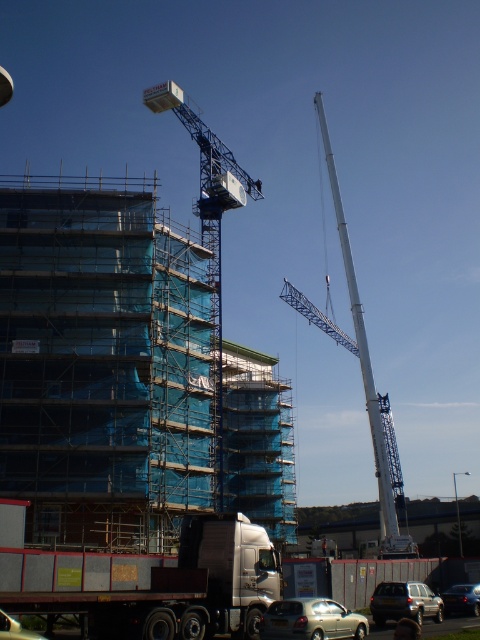
Question: Is metallic silver truck at lower left below metallic silver car at lower center?

Choices:
 (A) yes
 (B) no

Answer: (B)

Question: Which of the following is the closest to the observer?

Choices:
 (A) white metallic crane at center
 (B) metallic silver car at lower center
 (C) metallic silver truck at lower left
 (D) blue metallic crane at upper center

Answer: (C)

Question: Which object appears closest to the camera in this image?

Choices:
 (A) metallic silver truck at lower left
 (B) shiny silver sedan at lower right
 (C) silver metallic suv at lower right

Answer: (A)

Question: Observing the image, what is the correct spatial positioning of white metallic crane at center in reference to shiny silver sedan at lower right?

Choices:
 (A) left
 (B) right

Answer: (B)

Question: Does white metallic crane at center appear over metallic silver car at lower left?

Choices:
 (A) yes
 (B) no

Answer: (A)

Question: Which object appears closest to the camera in this image?

Choices:
 (A) metallic silver car at lower center
 (B) metallic silver truck at lower left
 (C) white metallic crane at center
 (D) silver metallic suv at lower right

Answer: (B)